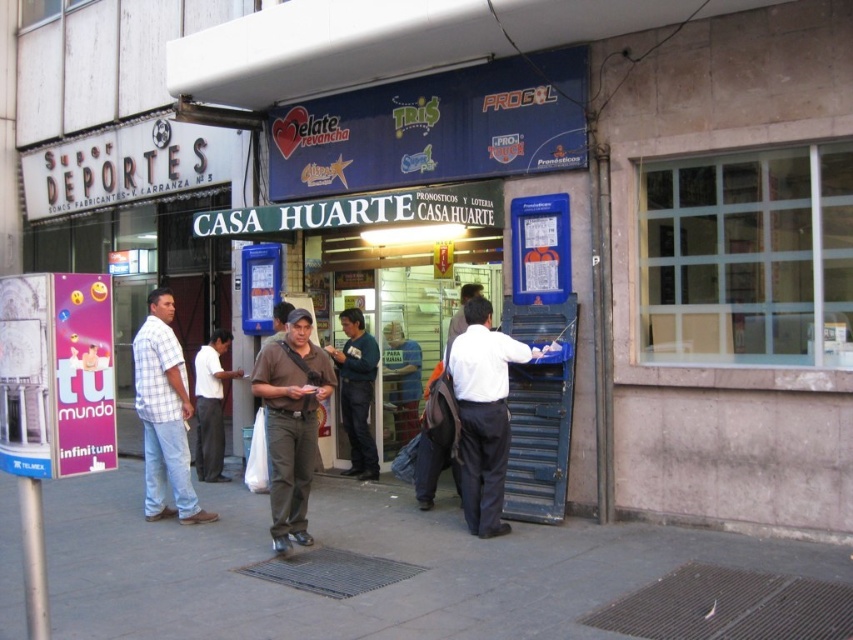
You are a delivery person standing at the entrance of Casa Huarte. You need to place a package on the gray concrete sidewalk at lower center and the white smooth shirt at center. Which surface can you place the package on without it being higher than the other object?

The gray concrete sidewalk at lower center has a lesser height compared to the white smooth shirt at center. Therefore, placing the package on the gray concrete sidewalk at lower center ensures it won

You are a delivery person standing at the entrance of Casa Huarte. You need to place a package between the white smooth shirt at center and the dark blue sweater at center. The package is 4 feet long. Can you fit it between them?

The white smooth shirt at center and dark blue sweater at center are 8.00 feet apart, so yes, the package can be placed between them as the distance is sufficient to accommodate the 4 feet length.